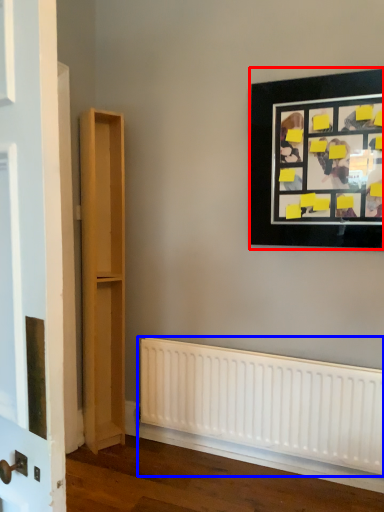
Question: Among these objects, which one is nearest to the camera, picture frame (highlighted by a red box) or radiator (highlighted by a blue box)?

Choices:
 (A) picture frame
 (B) radiator

Answer: (A)